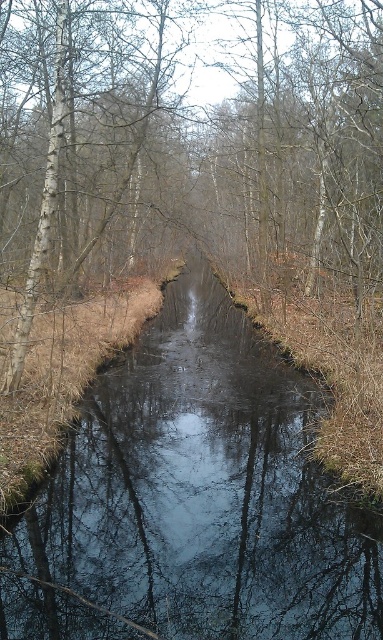
Question: Does dark reflective water at center appear on the left side of brown smooth tree at center?

Choices:
 (A) no
 (B) yes

Answer: (A)

Question: Observing the image, what is the correct spatial positioning of dark reflective water at center in reference to brown smooth tree at center?

Choices:
 (A) below
 (B) above

Answer: (A)

Question: Which point is farther to the camera?

Choices:
 (A) (237, 68)
 (B) (312, 637)

Answer: (A)

Question: Which of the following is the farthest from the observer?

Choices:
 (A) dark reflective water at center
 (B) brown smooth tree at center

Answer: (B)

Question: Which point is closer to the camera taking this photo?

Choices:
 (A) (x=348, y=632)
 (B) (x=14, y=122)

Answer: (A)

Question: Does dark reflective water at center appear on the right side of brown smooth tree at center?

Choices:
 (A) yes
 (B) no

Answer: (A)